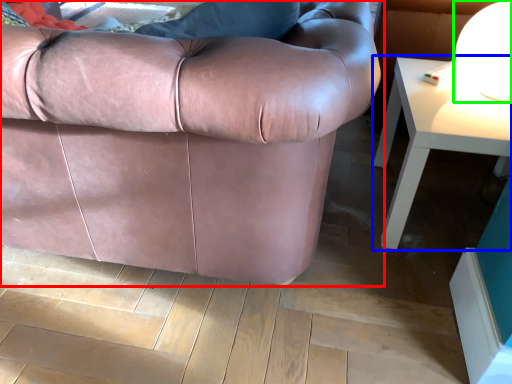
Question: Based on their relative distances, which object is farther from studio couch (highlighted by a red box)? Choose from table (highlighted by a blue box) and table lamp (highlighted by a green box).

Choices:
 (A) table
 (B) table lamp

Answer: (B)